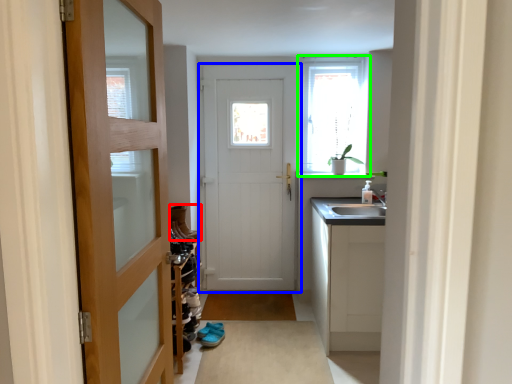
Question: Estimate the real-world distances between objects in this image. Which object is closer to shoe (highlighted by a red box), door (highlighted by a blue box) or window (highlighted by a green box)?

Choices:
 (A) door
 (B) window

Answer: (A)